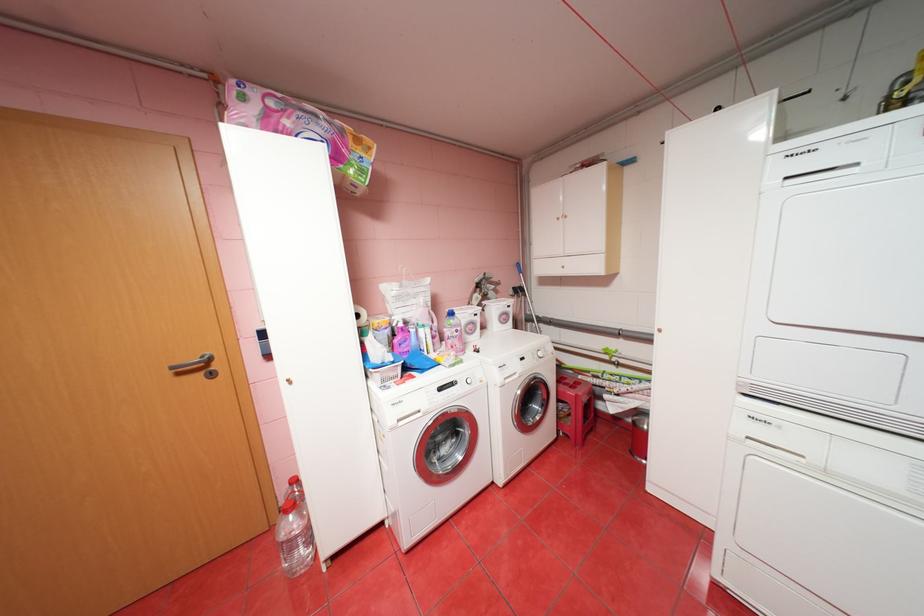
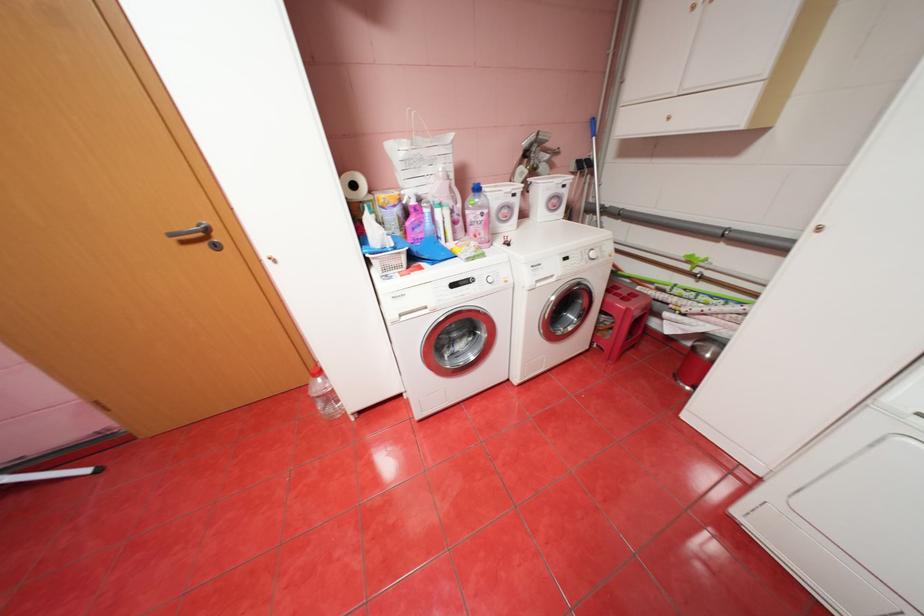
Locate, in the second image, the point that corresponds to pixel 412 291 in the first image.

(423, 151)